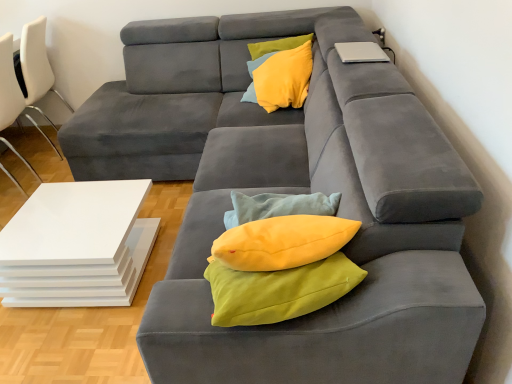
Question: Is white glossy table at lower left to the left of yellow fabric pillow at upper center from the viewer's perspective?

Choices:
 (A) yes
 (B) no

Answer: (A)

Question: Is white glossy table at lower left turned away from yellow fabric pillow at upper center?

Choices:
 (A) no
 (B) yes

Answer: (A)

Question: Considering the relative sizes of white glossy table at lower left and yellow fabric pillow at upper center in the image provided, is white glossy table at lower left taller than yellow fabric pillow at upper center?

Choices:
 (A) no
 (B) yes

Answer: (B)

Question: Does white glossy table at lower left touch yellow fabric pillow at upper center?

Choices:
 (A) no
 (B) yes

Answer: (A)

Question: From the image's perspective, is white glossy table at lower left on top of yellow fabric pillow at upper center?

Choices:
 (A) no
 (B) yes

Answer: (A)

Question: Looking at their shapes, would you say yellow fabric pillow at upper center is wider or thinner than white leather chair at left, the first chair from the back?

Choices:
 (A) thin
 (B) wide

Answer: (A)

Question: Is yellow fabric pillow at upper center inside the boundaries of white leather chair at left, the first chair from the back, or outside?

Choices:
 (A) inside
 (B) outside

Answer: (B)

Question: From their relative heights in the image, would you say yellow fabric pillow at upper center is taller or shorter than white leather chair at left, the second chair when ordered from front to back?

Choices:
 (A) short
 (B) tall

Answer: (A)

Question: Does point (266, 86) appear closer or farther from the camera than point (37, 129)?

Choices:
 (A) farther
 (B) closer

Answer: (B)

Question: In terms of height, does silver metallic laptop at upper right look taller or shorter compared to white leather chair at left, the second chair when ordered from front to back?

Choices:
 (A) tall
 (B) short

Answer: (B)

Question: Is silver metallic laptop at upper right in front of or behind white leather chair at left, the first chair from the back, in the image?

Choices:
 (A) front
 (B) behind

Answer: (A)

Question: From a real-world perspective, is silver metallic laptop at upper right physically located above or below white leather chair at left, the second chair when ordered from front to back?

Choices:
 (A) above
 (B) below

Answer: (A)

Question: Considering the positions of silver metallic laptop at upper right and white leather chair at left, the second chair when ordered from front to back, in the image, is silver metallic laptop at upper right wider or thinner than white leather chair at left, the second chair when ordered from front to back,?

Choices:
 (A) wide
 (B) thin

Answer: (B)

Question: From a real-world perspective, is soft gray footrest at lower center physically located above or below white glossy table at lower left?

Choices:
 (A) above
 (B) below

Answer: (A)

Question: Looking at their shapes, would you say soft gray footrest at lower center is wider or thinner than white glossy table at lower left?

Choices:
 (A) wide
 (B) thin

Answer: (B)